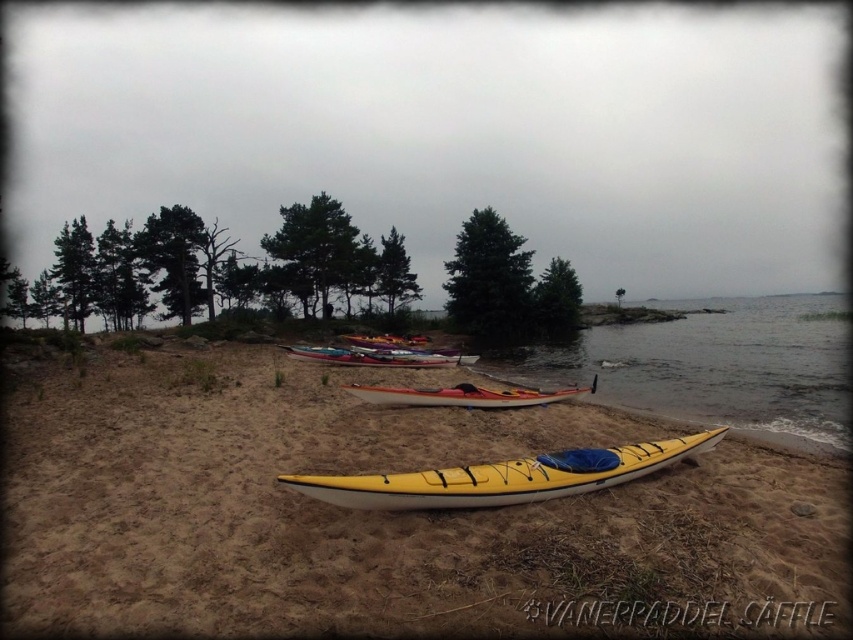
Who is lower down, orange matte kayak at center or matte red kayak at center?

Positioned lower is orange matte kayak at center.

The height and width of the screenshot is (640, 853). What do you see at coordinates (465, 396) in the screenshot? I see `orange matte kayak at center` at bounding box center [465, 396].

You are a GUI agent. You are given a task and a screenshot of the screen. Output one action in this format:
    pyautogui.click(x=<x>, y=<y>)
    Task: Click on the orange matte kayak at center
    
    Given the screenshot: What is the action you would take?
    pyautogui.click(x=465, y=396)

Between point (506, 362) and point (457, 496), which one is positioned behind?

Positioned behind is point (506, 362).

Which is more to the right, yellow plastic kayak at lower center or yellow matte kayak at center?

yellow plastic kayak at lower center is more to the right.

Does point (656, 355) come farther from viewer compared to point (503, 486)?

Yes, point (656, 355) is behind point (503, 486).

The width and height of the screenshot is (853, 640). What are the coordinates of `yellow plastic kayak at lower center` in the screenshot? It's located at (714, 364).

Between yellow plastic kayak at lower center and matte red kayak at center, which one is positioned lower?

matte red kayak at center is below.

Is point (695, 312) positioned before point (425, 364)?

No, it is not.

Between point (635, 364) and point (328, 360), which one is positioned behind?

The point (635, 364) is behind.

This screenshot has height=640, width=853. I want to click on yellow plastic kayak at lower center, so click(x=714, y=364).